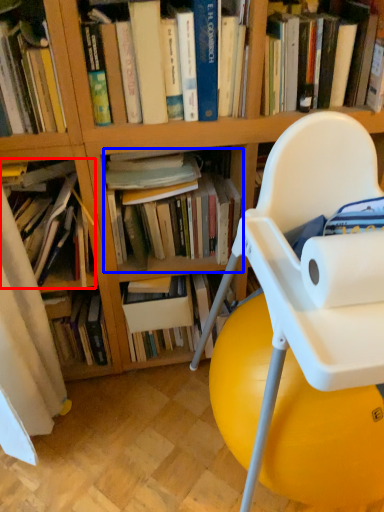
Question: Among these objects, which one is farthest to the camera, book (highlighted by a red box) or book (highlighted by a blue box)?

Choices:
 (A) book
 (B) book

Answer: (B)